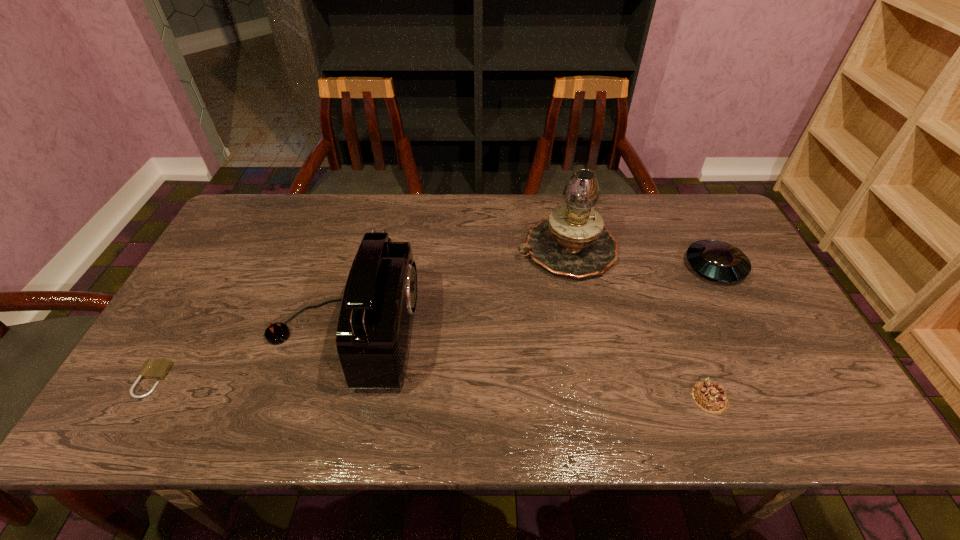
Image resolution: width=960 pixels, height=540 pixels. Find the location of `vacant space situated 0.240m on the back of the saucer`. vacant space situated 0.240m on the back of the saucer is located at coordinates (680, 200).

Find the location of a particular element. This screenshot has height=540, width=960. free region located 0.170m on the back of the second shortest object is located at coordinates (681, 325).

Where is `free space located on the right of the leftmost object`? free space located on the right of the leftmost object is located at coordinates (195, 380).

Find the location of a particular element. The image size is (960, 540). object that is at the far edge is located at coordinates (572, 241).

The image size is (960, 540). What are the coordinates of `chocolate cake that is positioned at the near edge` in the screenshot? It's located at (710, 397).

You are a GUI agent. You are given a task and a screenshot of the screen. Output one action in this format:
    pyautogui.click(x=<x>, y=<y>)
    Task: Click on the padlock located in the near edge section of the desktop
    The width and height of the screenshot is (960, 540).
    Given the screenshot: What is the action you would take?
    pyautogui.click(x=153, y=368)

At what (x,y) coordinates should I click in order to perform the action: click on object present at the left edge. Please return your answer as a coordinate pair (x, y). This screenshot has height=540, width=960. Looking at the image, I should click on (153, 368).

Where is `object that is at the right edge`? Image resolution: width=960 pixels, height=540 pixels. object that is at the right edge is located at coordinates (717, 260).

You are a GUI agent. You are given a task and a screenshot of the screen. Output one action in this format:
    pyautogui.click(x=<x>, y=<y>)
    Task: Click on the object that is at the near left corner
    
    Given the screenshot: What is the action you would take?
    pyautogui.click(x=153, y=368)

Identify the location of free space at the far edge of the desktop. The image size is (960, 540). (348, 220).